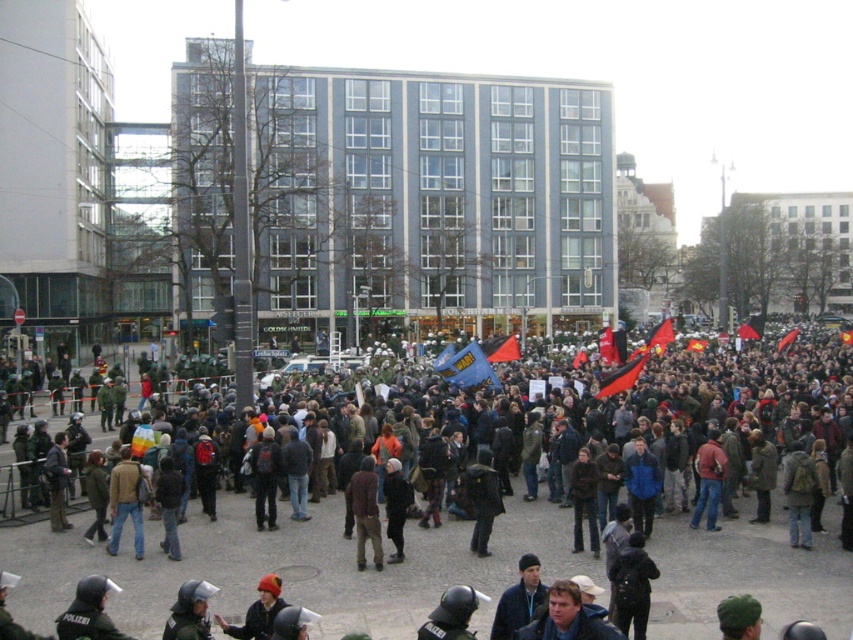
Where is `brown leather jacket at lower left`? Image resolution: width=853 pixels, height=640 pixels. brown leather jacket at lower left is located at coordinates coord(125,502).

Does brown leather jacket at lower left appear under brown fabric jacket at center?

Yes.

Which is behind, point (137, 516) or point (352, 513)?

The point (352, 513) is behind.

Image resolution: width=853 pixels, height=640 pixels. In order to click on brown leather jacket at lower left in this screenshot , I will do `click(125, 502)`.

Is point (589, 614) closer to viewer compared to point (136, 538)?

Yes, it is in front of point (136, 538).

What do you see at coordinates (567, 618) in the screenshot?
I see `blue fabric jacket at lower center` at bounding box center [567, 618].

Measure the distance between blue fabric jacket at lower center and camera.

blue fabric jacket at lower center is 16.93 meters from camera.

What are the coordinates of `blue fabric jacket at lower center` in the screenshot? It's located at (567, 618).

Does brown leather jacket at lower left appear on the left side of metallic helmet at lower left?

Correct, you'll find brown leather jacket at lower left to the left of metallic helmet at lower left.

Who is more distant from viewer, [135,486] or [200,611]?

Point [135,486]

Is point (120, 481) in front of point (167, 627)?

No, (120, 481) is behind (167, 627).

This screenshot has height=640, width=853. I want to click on brown leather jacket at lower left, so click(x=125, y=502).